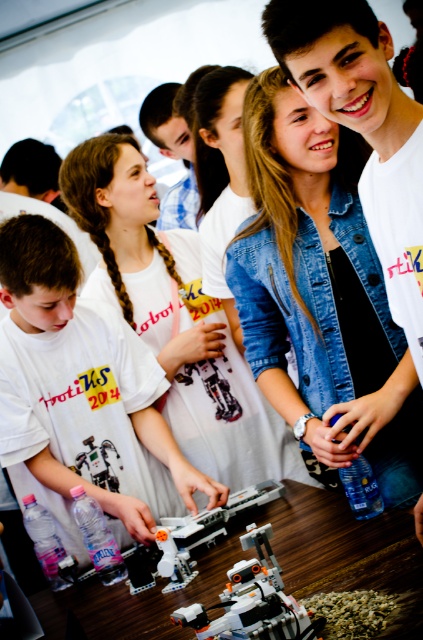
Question: Which point is farther to the camera?

Choices:
 (A) (255, 593)
 (B) (285, 483)

Answer: (B)

Question: Is denim jacket at upper right to the left of white matte t-shirt at lower left from the viewer's perspective?

Choices:
 (A) yes
 (B) no

Answer: (B)

Question: Is white plastic table at lower center above translucent plastic robot at center?

Choices:
 (A) no
 (B) yes

Answer: (A)

Question: Considering the real-world distances, which object is farthest from the white matte t-shirt at lower left?

Choices:
 (A) translucent plastic robot at center
 (B) white plastic robot at center

Answer: (B)

Question: Which object is the closest to the translucent plastic robot at center?

Choices:
 (A) white plastic table at lower center
 (B) white plastic robot at center

Answer: (A)

Question: In this image, where is denim jacket at upper right located relative to translucent plastic robot at center?

Choices:
 (A) below
 (B) above

Answer: (B)